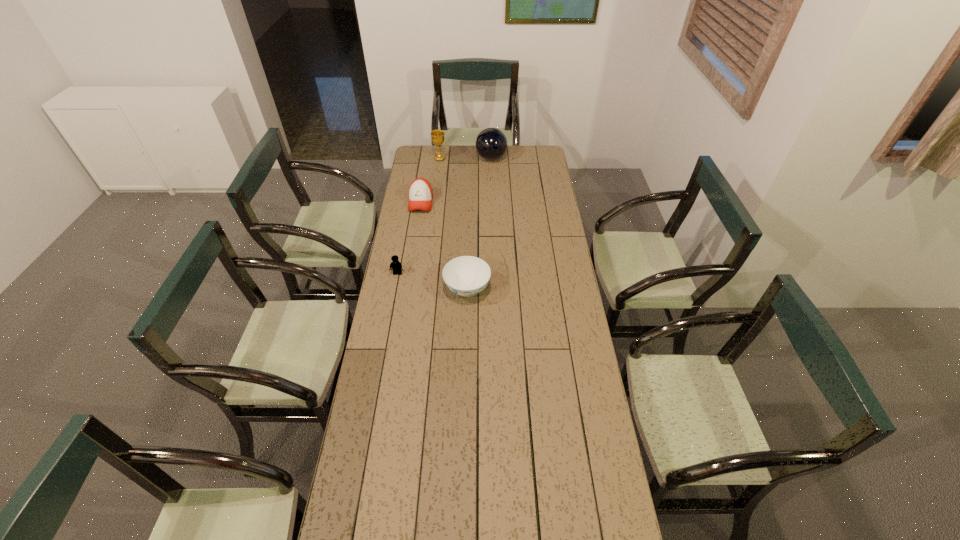
You are a GUI agent. You are given a task and a screenshot of the screen. Output one action in this format:
    pyautogui.click(x=<x>, y=<y>)
    Task: Click on the vacant space located 0.260m on the back of the chinaware
    This screenshot has height=540, width=960.
    Given the screenshot: What is the action you would take?
    pyautogui.click(x=468, y=233)

This screenshot has height=540, width=960. Identify the location of vacant space located 0.280m on the front-facing side of the Lego. (387, 330).

You are a GUI agent. You are given a task and a screenshot of the screen. Output one action in this format:
    pyautogui.click(x=<x>, y=<y>)
    Task: Click on the bowling ball that is at the far edge
    The height and width of the screenshot is (540, 960).
    Given the screenshot: What is the action you would take?
    (491, 143)

Where is `chalice present at the far edge`? chalice present at the far edge is located at coordinates (437, 136).

Locate an element on the screen. This screenshot has width=960, height=540. chalice present at the left edge is located at coordinates (437, 136).

At what (x,y) coordinates should I click in order to perform the action: click on baseball cap present at the left edge. Please return your answer as a coordinate pair (x, y). Looking at the image, I should click on (420, 192).

The image size is (960, 540). I want to click on Lego located in the left edge section of the desktop, so click(396, 266).

You are a GUI agent. You are given a task and a screenshot of the screen. Output one action in this format:
    pyautogui.click(x=<x>, y=<y>)
    Task: Click on the object situated at the far left corner
    The image size is (960, 540).
    Given the screenshot: What is the action you would take?
    pyautogui.click(x=437, y=136)

The height and width of the screenshot is (540, 960). What are the coordinates of `vacant space at the far edge` in the screenshot? It's located at (457, 156).

I want to click on free spot at the left edge of the desktop, so coord(378,321).